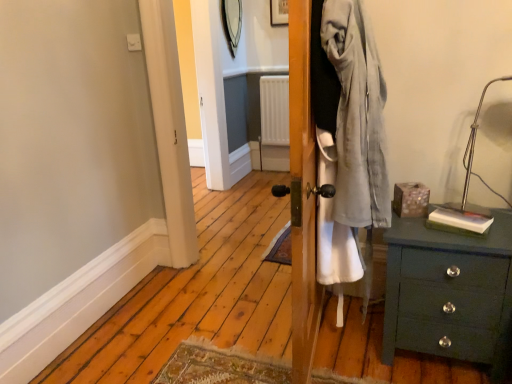
The image size is (512, 384). What do you see at coordinates (279, 13) in the screenshot?
I see `wooden picture frame at upper center` at bounding box center [279, 13].

Describe the element at coordinates (232, 22) in the screenshot. The height and width of the screenshot is (384, 512). I see `metallic silver mirror at upper center` at that location.

The height and width of the screenshot is (384, 512). Identify the location of wooden picture frame at upper center. (279, 13).

Considering the relative sizes of metallic silver mirror at upper center and wooden picture frame at upper center in the image provided, is metallic silver mirror at upper center wider than wooden picture frame at upper center?

Indeed, metallic silver mirror at upper center has a greater width compared to wooden picture frame at upper center.

Is metallic silver mirror at upper center surrounding wooden picture frame at upper center?

No, wooden picture frame at upper center is located outside of metallic silver mirror at upper center.

Are green wood chest of drawers at lower right and metallic silver mirror at upper center making contact?

No, green wood chest of drawers at lower right is not next to metallic silver mirror at upper center.

Is green wood chest of drawers at lower right wider than metallic silver mirror at upper center?

Yes.

Is metallic silver mirror at upper center at the back of green wood chest of drawers at lower right?

No, green wood chest of drawers at lower right's orientation is not away from metallic silver mirror at upper center.

From the picture: From a real-world perspective, which object stands above the other?

metallic silver mirror at upper center is physically above.

Considering the relative sizes of metallic silver table lamp at upper right and wooden picture frame at upper center in the image provided, is metallic silver table lamp at upper right taller than wooden picture frame at upper center?

Indeed, metallic silver table lamp at upper right has a greater height compared to wooden picture frame at upper center.

Is metallic silver table lamp at upper right at the right side of wooden picture frame at upper center?

Yes.

Is wooden picture frame at upper center at the back of metallic silver table lamp at upper right?

No, wooden picture frame at upper center is not at the back of metallic silver table lamp at upper right.

From the picture: Considering the positions of objects metallic silver table lamp at upper right and wooden picture frame at upper center in the image provided, who is behind, metallic silver table lamp at upper right or wooden picture frame at upper center?

wooden picture frame at upper center is further from the camera.

Does metallic silver mirror at upper center turn towards green wood chest of drawers at lower right?

No.

The height and width of the screenshot is (384, 512). Find the location of `the chest of drawers located below the metallic silver mirror at upper center (from the image's perspective)`. the chest of drawers located below the metallic silver mirror at upper center (from the image's perspective) is located at coordinates (449, 293).

From a real-world perspective, which is physically below, metallic silver mirror at upper center or green wood chest of drawers at lower right?

green wood chest of drawers at lower right is physically lower.

Is point (229, 1) farther from camera compared to point (421, 240)?

Yes.

Is green wood chest of drawers at lower right positioned in front of metallic silver table lamp at upper right?

Yes, green wood chest of drawers at lower right is in front of metallic silver table lamp at upper right.

In terms of height, does green wood chest of drawers at lower right look taller or shorter compared to metallic silver table lamp at upper right?

Clearly, green wood chest of drawers at lower right is shorter compared to metallic silver table lamp at upper right.

Is green wood chest of drawers at lower right aimed at metallic silver table lamp at upper right?

No, green wood chest of drawers at lower right is not turned towards metallic silver table lamp at upper right.

Which is in front, wooden picture frame at upper center or metallic silver table lamp at upper right?

metallic silver table lamp at upper right is in front.

Where is `picture frame located behind the metallic silver table lamp at upper right`? This screenshot has width=512, height=384. picture frame located behind the metallic silver table lamp at upper right is located at coordinates (279, 13).

Considering the relative positions of wooden picture frame at upper center and metallic silver table lamp at upper right in the image provided, is wooden picture frame at upper center to the left or to the right of metallic silver table lamp at upper right?

In the image, wooden picture frame at upper center appears on the left side of metallic silver table lamp at upper right.

Considering the sizes of wooden picture frame at upper center and metallic silver table lamp at upper right in the image, is wooden picture frame at upper center taller or shorter than metallic silver table lamp at upper right?

Clearly, wooden picture frame at upper center is shorter compared to metallic silver table lamp at upper right.

Which object is further away from the camera taking this photo, metallic silver table lamp at upper right or green wood chest of drawers at lower right?

metallic silver table lamp at upper right is further away from the camera.

Based on the photo, is metallic silver table lamp at upper right bigger than green wood chest of drawers at lower right?

No, metallic silver table lamp at upper right is not bigger than green wood chest of drawers at lower right.

You are a GUI agent. You are given a task and a screenshot of the screen. Output one action in this format:
    pyautogui.click(x=<x>, y=<y>)
    Task: Click on the table lamp above the green wood chest of drawers at lower right (from the image's perspective)
    The image size is (512, 384).
    Given the screenshot: What is the action you would take?
    pyautogui.click(x=472, y=161)

Is metallic silver table lamp at upper right oriented towards green wood chest of drawers at lower right?

No, metallic silver table lamp at upper right is not aimed at green wood chest of drawers at lower right.

Where is `mirror in front of the wooden picture frame at upper center`? The image size is (512, 384). mirror in front of the wooden picture frame at upper center is located at coordinates (232, 22).

There is a green wood chest of drawers at lower right. Identify the location of mirror above it (from a real-world perspective). (232, 22).

Considering their positions, is green wood chest of drawers at lower right positioned further to metallic silver mirror at upper center than wooden picture frame at upper center?

green wood chest of drawers at lower right.

Which object lies further to the anchor point metallic silver mirror at upper center, green wood chest of drawers at lower right or metallic silver table lamp at upper right?

green wood chest of drawers at lower right.

When comparing their distances from metallic silver mirror at upper center, does wooden picture frame at upper center or green wood chest of drawers at lower right seem further?

green wood chest of drawers at lower right is positioned further to the anchor metallic silver mirror at upper center.

Which object lies further to the anchor point green wood chest of drawers at lower right, wooden picture frame at upper center or metallic silver table lamp at upper right?

wooden picture frame at upper center is positioned further to the anchor green wood chest of drawers at lower right.

When comparing their distances from green wood chest of drawers at lower right, does metallic silver mirror at upper center or wooden picture frame at upper center seem further?

wooden picture frame at upper center is positioned further to the anchor green wood chest of drawers at lower right.

Considering their positions, is metallic silver table lamp at upper right positioned closer to green wood chest of drawers at lower right than wooden picture frame at upper center?

The object closer to green wood chest of drawers at lower right is metallic silver table lamp at upper right.

From the image, which object appears to be nearer to metallic silver table lamp at upper right, green wood chest of drawers at lower right or wooden picture frame at upper center?

green wood chest of drawers at lower right.

In the scene shown: Estimate the real-world distances between objects in this image. Which object is closer to metallic silver mirror at upper center, metallic silver table lamp at upper right or wooden picture frame at upper center?

wooden picture frame at upper center is positioned closer to the anchor metallic silver mirror at upper center.

Where is `table lamp positioned between green wood chest of drawers at lower right and metallic silver mirror at upper center from near to far`? table lamp positioned between green wood chest of drawers at lower right and metallic silver mirror at upper center from near to far is located at coordinates (472, 161).

Find the location of a particular element. The width and height of the screenshot is (512, 384). mirror between metallic silver table lamp at upper right and wooden picture frame at upper center along the z-axis is located at coordinates (232, 22).

I want to click on table lamp positioned between green wood chest of drawers at lower right and wooden picture frame at upper center from near to far, so click(x=472, y=161).

Find the location of a particular element. mirror between green wood chest of drawers at lower right and wooden picture frame at upper center along the z-axis is located at coordinates (232, 22).